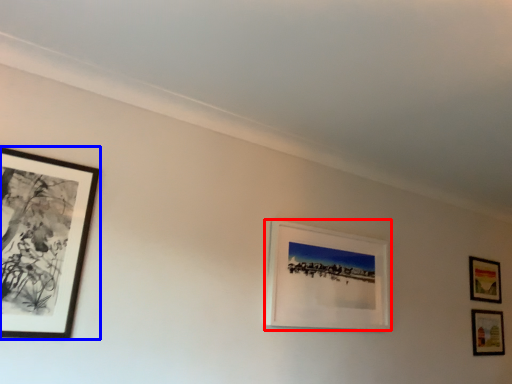
Question: Which object is further to the camera taking this photo, picture frame (highlighted by a red box) or picture frame (highlighted by a blue box)?

Choices:
 (A) picture frame
 (B) picture frame

Answer: (A)